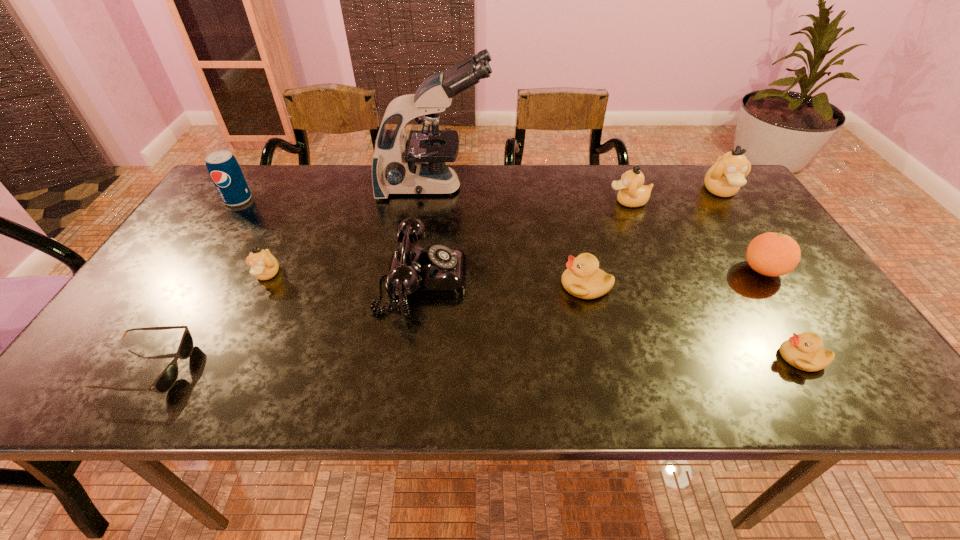
You are a GUI agent. You are given a task and a screenshot of the screen. Output one action in this format:
    pyautogui.click(x=<x>, y=<y>)
    Task: Click on the free space located on the lenses of the sunglasses
    
    Given the screenshot: What is the action you would take?
    pyautogui.click(x=318, y=368)

This screenshot has height=540, width=960. I want to click on microscope present at the far edge, so click(x=416, y=165).

Find the location of a particular element. pop that is positioned at the far edge is located at coordinates (225, 172).

You are a GUI agent. You are given a task and a screenshot of the screen. Output one action in this format:
    pyautogui.click(x=<x>, y=<y>)
    Task: Click on the duckling present at the near edge
    This screenshot has height=540, width=960.
    Given the screenshot: What is the action you would take?
    pyautogui.click(x=804, y=351)

Identify the location of sunglasses at the near edge. (165, 381).

Find the location of `pop at the left edge`. pop at the left edge is located at coordinates (225, 172).

What are the coordinates of `sunglasses that is at the left edge` in the screenshot? It's located at (165, 381).

This screenshot has width=960, height=540. I want to click on orange that is positioned at the right edge, so click(x=772, y=254).

The width and height of the screenshot is (960, 540). Find the location of `object situated at the far left corner`. object situated at the far left corner is located at coordinates (225, 172).

Locate an element on the screen. This screenshot has height=540, width=960. object that is at the near left corner is located at coordinates (165, 381).